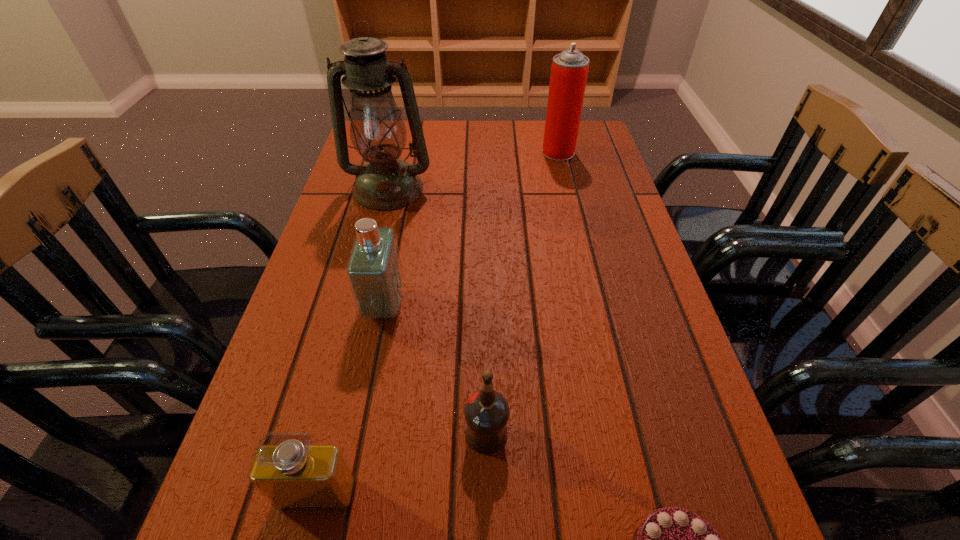
In order to click on vacant region at the far edge in this screenshot , I will do (442, 130).

In order to click on vacant space at the left edge in this screenshot , I will do `click(358, 360)`.

In the image, there is a desktop. Find the location of `blank space at the right edge`. blank space at the right edge is located at coordinates (718, 522).

This screenshot has width=960, height=540. What are the coordinates of `vacant space at the far right corner` in the screenshot? It's located at (598, 131).

I want to click on free space between the third object from right to left and the taller perfume, so click(x=436, y=369).

Where is `free spot between the nearer perfume and the farther perfume`? This screenshot has width=960, height=540. free spot between the nearer perfume and the farther perfume is located at coordinates (350, 400).

In order to click on empty space that is in between the vodka and the second tallest object in this screenshot , I will do `click(522, 293)`.

This screenshot has width=960, height=540. In order to click on object that is the fourth closest one to the oil lamp in this screenshot , I will do `click(292, 473)`.

Select which object appears as the third closest to the tallest object. Please provide its 2D coordinates. Your answer should be formatted as a tuple, i.e. [(x, y)], where the tuple contains the x and y coordinates of a point satisfying the conditions above.

[(486, 411)]

Where is `free space that satisfies the following two spatial constraints: 1. on the front label of the third tallest object; 2. on the front-facing side of the nearer perfume`? The width and height of the screenshot is (960, 540). free space that satisfies the following two spatial constraints: 1. on the front label of the third tallest object; 2. on the front-facing side of the nearer perfume is located at coordinates (348, 494).